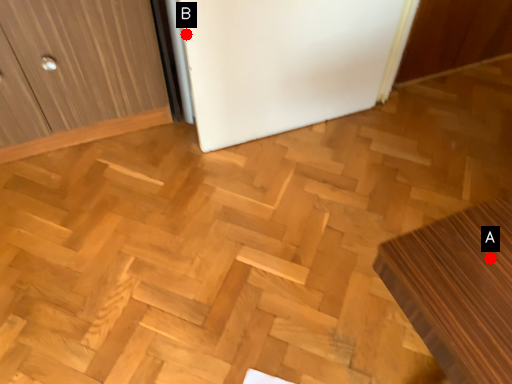
Question: Two points are circled on the image, labeled by A and B beside each circle. Which of the following is the closest to the observer?

Choices:
 (A) A is closer
 (B) B is closer

Answer: (A)